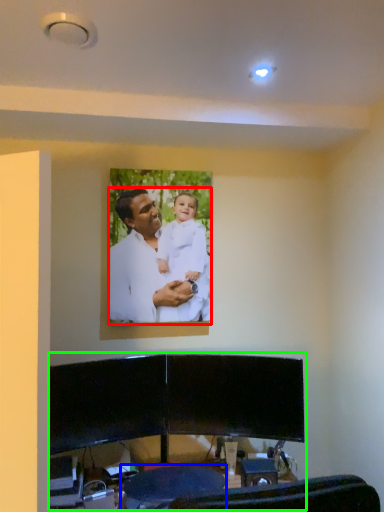
Question: Which is farther away from man (highlighted by a red box)? swivel chair (highlighted by a blue box) or entertainment center (highlighted by a green box)?

Choices:
 (A) swivel chair
 (B) entertainment center

Answer: (A)